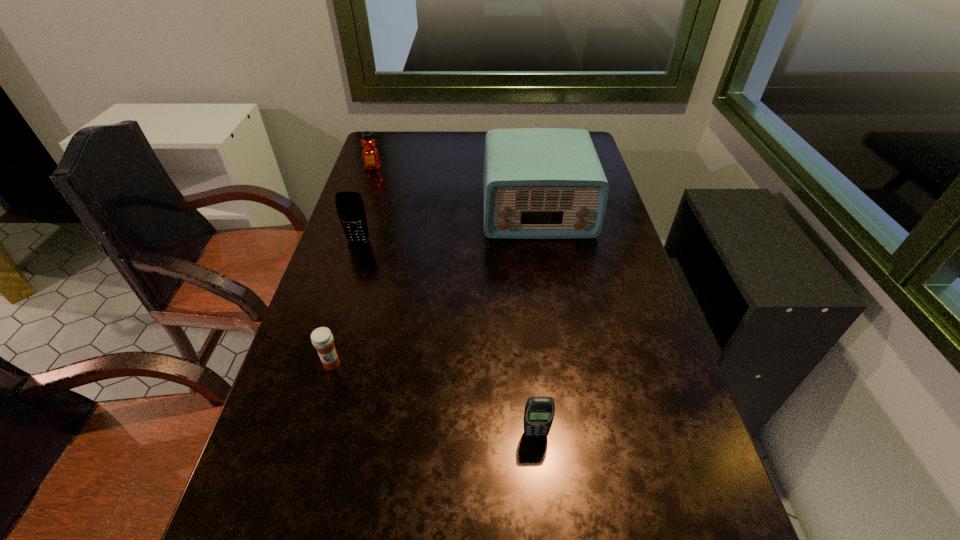
Identify the location of unoccupied area between the shorter cellular telephone and the radio receiver. (x=537, y=322).

Where is `free space between the right cellular telephone and the medicine`? The width and height of the screenshot is (960, 540). free space between the right cellular telephone and the medicine is located at coordinates (434, 399).

This screenshot has height=540, width=960. I want to click on vacant region between the shortest object and the taller cellular telephone, so click(x=345, y=303).

The height and width of the screenshot is (540, 960). Find the location of `vacant area between the left cellular telephone and the farthest object`. vacant area between the left cellular telephone and the farthest object is located at coordinates (366, 205).

Locate an element on the screen. Image resolution: width=960 pixels, height=540 pixels. free spot between the farthest object and the medicine is located at coordinates click(x=352, y=266).

Identify the location of free space between the honey and the second nearest object. (352, 266).

Find the location of `free area in between the second tallest object and the honey`. free area in between the second tallest object and the honey is located at coordinates (366, 205).

I want to click on unoccupied position between the left cellular telephone and the medicine, so click(345, 303).

I want to click on object that stands as the closest to the left cellular telephone, so click(x=539, y=183).

Locate which object ranks in proximity to the fourth shortest object. Please provide its 2D coordinates. Your answer should be formatted as a tuple, i.e. [(x, y)], where the tuple contains the x and y coordinates of a point satisfying the conditions above.

[(539, 183)]